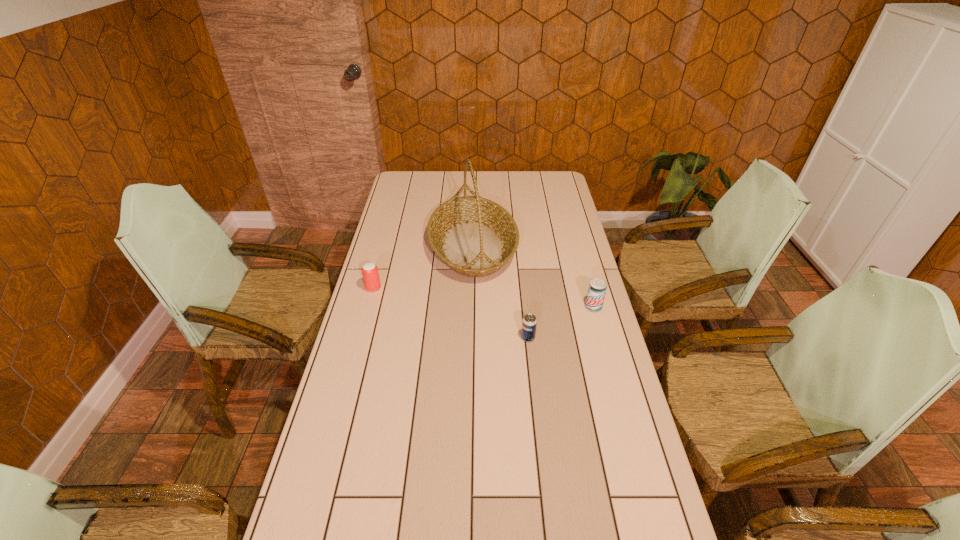
Find the location of a particular element. The image size is (960, 540). beer can that can be found as the closest to the basket is located at coordinates (370, 273).

This screenshot has height=540, width=960. I want to click on vacant space that satisfies the following two spatial constraints: 1. on the front side of the rightmost object; 2. on the right side of the tallest object, so [471, 307].

This screenshot has width=960, height=540. I want to click on free space that satisfies the following two spatial constraints: 1. on the front side of the basket; 2. on the right side of the third farthest object, so click(471, 307).

Locate an element on the screen. free space in the image that satisfies the following two spatial constraints: 1. on the back side of the nearest object; 2. on the left side of the third farthest object is located at coordinates (525, 307).